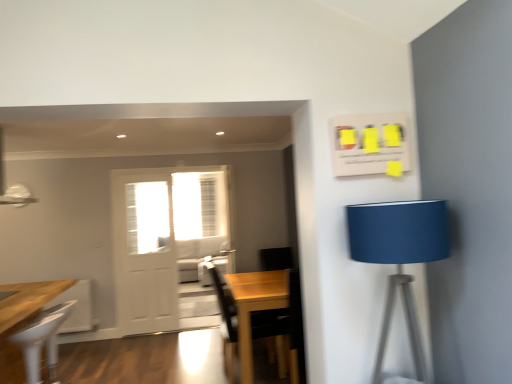
Question: Should I look upward or downward to see white sheer curtain at center?

Choices:
 (A) down
 (B) up

Answer: (A)

Question: Considering the relative positions of white glossy screen door at center and blue fabric lampshade at right in the image provided, is white glossy screen door at center to the left of blue fabric lampshade at right from the viewer's perspective?

Choices:
 (A) yes
 (B) no

Answer: (A)

Question: Is white glossy screen door at center positioned in front of blue fabric lampshade at right?

Choices:
 (A) no
 (B) yes

Answer: (A)

Question: Can you confirm if white glossy screen door at center is wider than blue fabric lampshade at right?

Choices:
 (A) yes
 (B) no

Answer: (B)

Question: Is there a large distance between white glossy screen door at center and blue fabric lampshade at right?

Choices:
 (A) yes
 (B) no

Answer: (A)

Question: Can you confirm if white glossy screen door at center is taller than blue fabric lampshade at right?

Choices:
 (A) yes
 (B) no

Answer: (A)

Question: From the image's perspective, is white glossy screen door at center located above blue fabric lampshade at right?

Choices:
 (A) no
 (B) yes

Answer: (A)

Question: Is white plastic chair at lower left in contact with white matte door at center?

Choices:
 (A) yes
 (B) no

Answer: (B)

Question: Is white plastic chair at lower left outside of white matte door at center?

Choices:
 (A) yes
 (B) no

Answer: (A)

Question: Is white plastic chair at lower left not near white matte door at center?

Choices:
 (A) yes
 (B) no

Answer: (A)

Question: Can you confirm if white plastic chair at lower left is taller than white matte door at center?

Choices:
 (A) yes
 (B) no

Answer: (B)

Question: Does white plastic chair at lower left turn towards white matte door at center?

Choices:
 (A) no
 (B) yes

Answer: (A)

Question: Can you confirm if white plastic chair at lower left is positioned to the left of white matte door at center?

Choices:
 (A) yes
 (B) no

Answer: (A)

Question: Would you say blue fabric lampshade at right is a long distance from white sheer curtain at center?

Choices:
 (A) yes
 (B) no

Answer: (A)